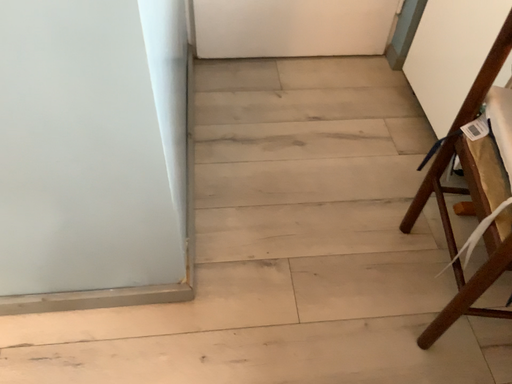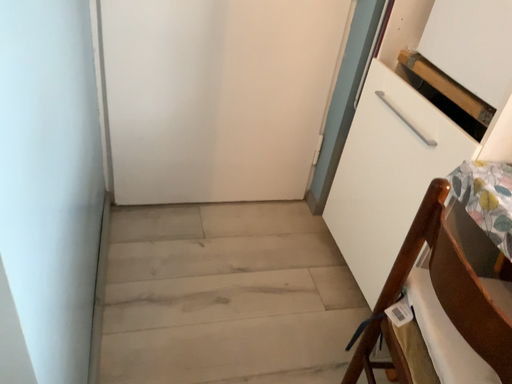
Question: Which way did the camera rotate in the video?

Choices:
 (A) rotated left
 (B) rotated right

Answer: (B)